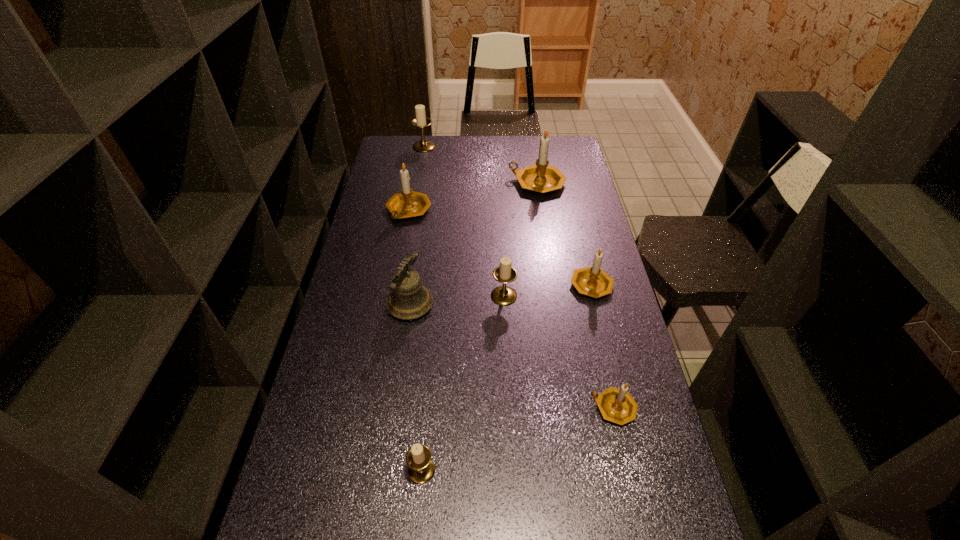
The height and width of the screenshot is (540, 960). I want to click on the biggest gold candle holder, so click(540, 177).

Locate an element on the screen. the tallest candle holder is located at coordinates (540, 177).

You are a GUI agent. You are given a task and a screenshot of the screen. Output one action in this format:
    pyautogui.click(x=<x>, y=<y>)
    Task: Click on the leftmost gold candle holder
    The width and height of the screenshot is (960, 540).
    Given the screenshot: What is the action you would take?
    pyautogui.click(x=408, y=203)

Locate an element on the screen. the leftmost white candle holder is located at coordinates (421, 120).

Identify the location of the farthest candle holder. (421, 120).

The width and height of the screenshot is (960, 540). I want to click on bell, so click(409, 299).

I want to click on the third farthest gold candle holder, so click(592, 281).

This screenshot has width=960, height=540. Find the location of `the second biggest white candle holder`. the second biggest white candle holder is located at coordinates (503, 295).

Where is `the second nearest white candle holder`? the second nearest white candle holder is located at coordinates (503, 295).

Identify the location of the second nearest candle holder. (616, 405).